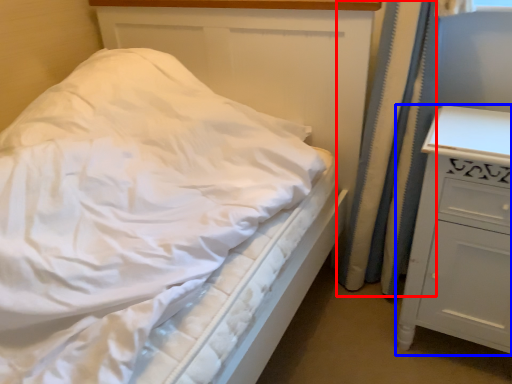
Question: Which object appears closest to the camera in this image, curtain (highlighted by a red box) or chest of drawers (highlighted by a blue box)?

Choices:
 (A) curtain
 (B) chest of drawers

Answer: (B)